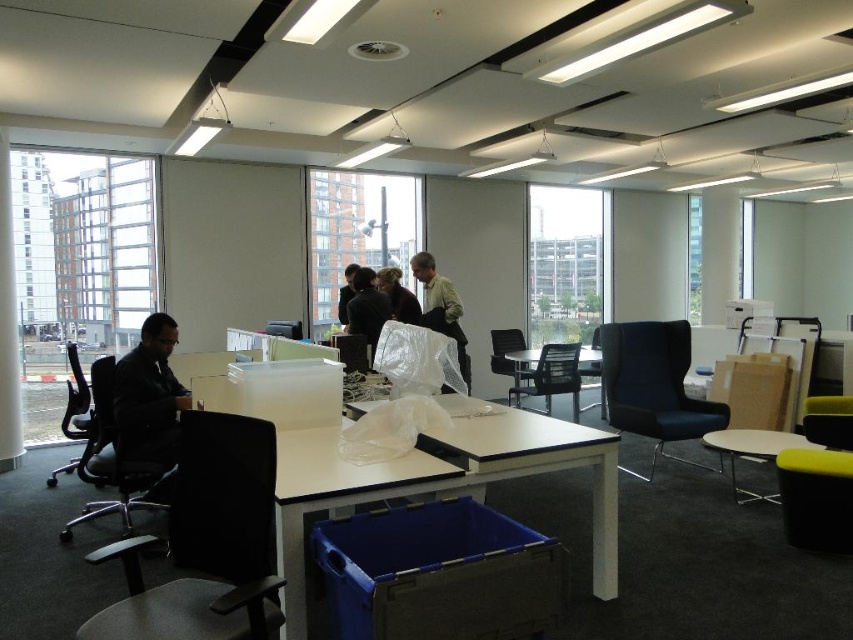
Between yellow fabric chair at lower right and white glossy table at lower right, which one appears on the left side from the viewer's perspective?

yellow fabric chair at lower right is more to the left.

In the scene shown: Measure the distance between point [817,483] and camera.

Point [817,483] is 3.36 meters away from camera.

Where is `yellow fabric chair at lower right`? The image size is (853, 640). yellow fabric chair at lower right is located at coordinates pos(819,477).

Looking at this image, does white glossy table at lower right appear over black mesh office chair at left?

Actually, white glossy table at lower right is below black mesh office chair at left.

Locate an element on the screen. white glossy table at lower right is located at coordinates point(753,452).

Is point (733, 440) in front of point (96, 436)?

No, (733, 440) is behind (96, 436).

Where is `white glossy table at lower right`? white glossy table at lower right is located at coordinates (753, 452).

Can you confirm if black fabric office chair at left is wider than black mesh office chair at left?

Incorrect, black fabric office chair at left's width does not surpass black mesh office chair at left's.

Is point (183, 429) in front of point (77, 420)?

Yes, it is.

Identify the location of black fabric office chair at left. (x=206, y=541).